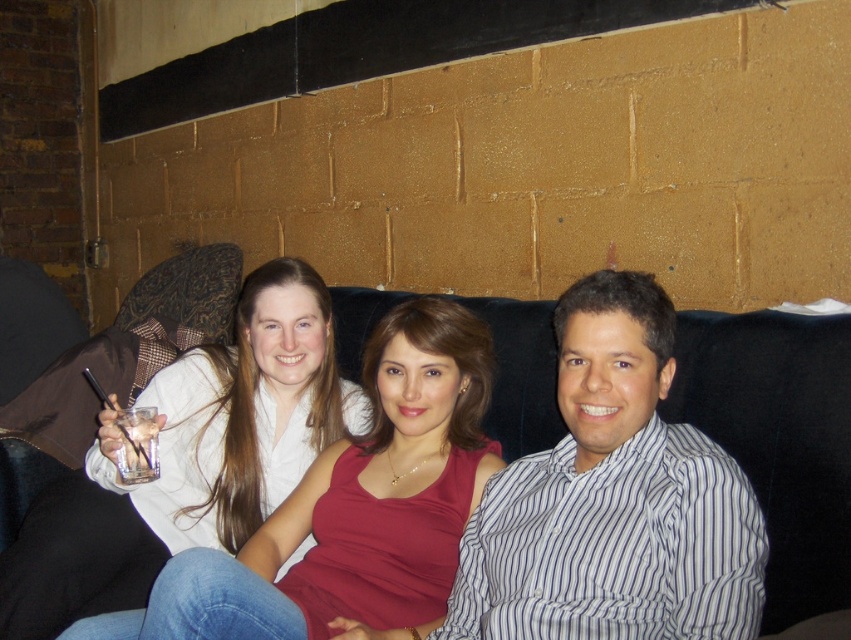
Question: Does white striped shirt at center lie behind white matte shirt at upper left?

Choices:
 (A) no
 (B) yes

Answer: (A)

Question: Which point is closer to the camera?

Choices:
 (A) (715, 600)
 (B) (734, 328)

Answer: (A)

Question: Is the position of white striped shirt at center less distant than that of black fabric couch at center?

Choices:
 (A) no
 (B) yes

Answer: (B)

Question: Where is white striped shirt at center located in relation to white matte shirt at upper left in the image?

Choices:
 (A) left
 (B) right

Answer: (B)

Question: Which point is farther to the camera?

Choices:
 (A) white striped shirt at center
 (B) black fabric couch at center
 (C) white matte shirt at upper left

Answer: (C)

Question: Which of the following is the closest to the observer?

Choices:
 (A) black fabric couch at center
 (B) white matte shirt at upper left

Answer: (A)